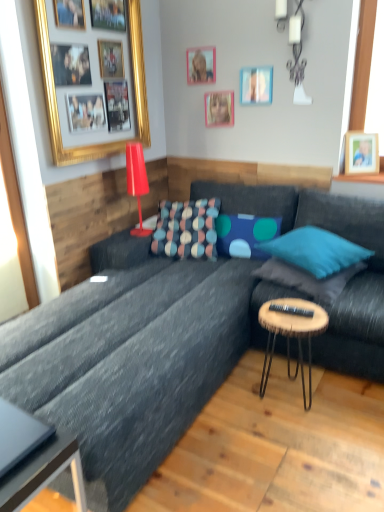
Locate an element on the screen. Image resolution: width=384 pixels, height=512 pixels. blue felt pillow at center, arranged as the 2th pillow when viewed from the left is located at coordinates (244, 234).

Find the location of a particular element. teal fabric pillow at center, which is counted as the third pillow, starting from the left is located at coordinates pyautogui.click(x=315, y=251).

You are a GUI agent. You are given a task and a screenshot of the screen. Output one action in this format:
    pyautogui.click(x=<x>, y=<y>)
    Task: Click on the white ceramic lamp at upper center, the 1th lamp in the right-to-left sequence
    Image resolution: width=384 pixels, height=512 pixels.
    Given the screenshot: What is the action you would take?
    pyautogui.click(x=297, y=55)

Which object is positioned more to the left, black plastic remote control at center or gold/gilded picture frame at upper left, the fifth picture frame viewed from the right?

From the viewer's perspective, gold/gilded picture frame at upper left, the fifth picture frame viewed from the right, appears more on the left side.

From a real-world perspective, which is physically above, black plastic remote control at center or gold/gilded picture frame at upper left, positioned as the 1th picture frame in left-to-right order?

From a 3D spatial view, gold/gilded picture frame at upper left, positioned as the 1th picture frame in left-to-right order, is above.

The height and width of the screenshot is (512, 384). I want to click on remote control to the right of gold/gilded picture frame at upper left, positioned as the 1th picture frame in left-to-right order, so click(x=291, y=310).

Which is correct: black plastic remote control at center is inside gold/gilded picture frame at upper left, the fifth picture frame viewed from the right, or outside of it?

black plastic remote control at center is outside gold/gilded picture frame at upper left, the fifth picture frame viewed from the right.

From a real-world perspective, is metallic gray coffee table at lower left positioned under wooden photo frame at upper center, the 4th picture frame when ordered from right to left, based on gravity?

Yes, from a real-world perspective, metallic gray coffee table at lower left is below wooden photo frame at upper center, the 4th picture frame when ordered from right to left.

What's the angular difference between metallic gray coffee table at lower left and wooden photo frame at upper center, the 4th picture frame when ordered from right to left,'s facing directions?

metallic gray coffee table at lower left and wooden photo frame at upper center, the 4th picture frame when ordered from right to left, are facing 89.9 degrees away from each other.

Is metallic gray coffee table at lower left wider or thinner than wooden photo frame at upper center, the 2th picture frame in the left-to-right sequence?

In the image, metallic gray coffee table at lower left appears to be wider than wooden photo frame at upper center, the 2th picture frame in the left-to-right sequence.

Identify the location of picture frame that is the 5th one when counting upward from the metallic gray coffee table at lower left (from the image's perspective). Image resolution: width=384 pixels, height=512 pixels. (201, 65).

From the image's perspective, is gold/gilded picture frame at upper left, the fifth picture frame viewed from the right, under textured gray couch at center?

No, from the image's perspective, gold/gilded picture frame at upper left, the fifth picture frame viewed from the right, is not below textured gray couch at center.

I want to click on picture frame that is the 3rd one when counting upward from the textured gray couch at center (from the image's perspective), so click(57, 105).

In terms of size, does gold/gilded picture frame at upper left, the fifth picture frame viewed from the right, appear bigger or smaller than textured gray couch at center?

Considering their sizes, gold/gilded picture frame at upper left, the fifth picture frame viewed from the right, takes up less space than textured gray couch at center.

Does gold/gilded picture frame at upper left, the fifth picture frame viewed from the right, have a greater height compared to textured gray couch at center?

Yes, gold/gilded picture frame at upper left, the fifth picture frame viewed from the right, is taller than textured gray couch at center.

Considering the sizes of wooden photo frame at upper center, the 2th picture frame in the left-to-right sequence, and wooden photo frame at upper right, acting as the 5th picture frame starting from the left, in the image, is wooden photo frame at upper center, the 2th picture frame in the left-to-right sequence, bigger or smaller than wooden photo frame at upper right, acting as the 5th picture frame starting from the left,?

wooden photo frame at upper center, the 2th picture frame in the left-to-right sequence, is smaller than wooden photo frame at upper right, acting as the 5th picture frame starting from the left.

In the scene shown: Is wooden photo frame at upper center, the 4th picture frame when ordered from right to left, looking in the opposite direction of wooden photo frame at upper right, acting as the 5th picture frame starting from the left?

wooden photo frame at upper center, the 4th picture frame when ordered from right to left, is not turned away from wooden photo frame at upper right, acting as the 5th picture frame starting from the left.

Can you confirm if wooden photo frame at upper center, the 2th picture frame in the left-to-right sequence, is positioned to the left of wooden photo frame at upper right, the 1th picture frame from the right?

Correct, you'll find wooden photo frame at upper center, the 2th picture frame in the left-to-right sequence, to the left of wooden photo frame at upper right, the 1th picture frame from the right.

Is wooden stool at center facing away from black plastic remote control at center?

That's not correct — wooden stool at center is not looking away from black plastic remote control at center.

From the image's perspective, which is above, wooden stool at center or black plastic remote control at center?

black plastic remote control at center, from the image's perspective.

Looking at the image, does wooden stool at center seem bigger or smaller compared to black plastic remote control at center?

wooden stool at center is bigger than black plastic remote control at center.

Based on the photo, is wooden stool at center positioned beyond the bounds of black plastic remote control at center?

wooden stool at center is positioned outside black plastic remote control at center.

Is teal fabric pillow at center, arranged as the 4th pillow when viewed from the left, shorter than wooden photo frame at upper center, the 2th picture frame in the left-to-right sequence?

Yes, teal fabric pillow at center, arranged as the 4th pillow when viewed from the left, is shorter than wooden photo frame at upper center, the 2th picture frame in the left-to-right sequence.

Is the surface of teal fabric pillow at center, arranged as the 4th pillow when viewed from the left, in direct contact with wooden photo frame at upper center, the 2th picture frame in the left-to-right sequence?

No, teal fabric pillow at center, arranged as the 4th pillow when viewed from the left, is not with wooden photo frame at upper center, the 2th picture frame in the left-to-right sequence.

Can we say teal fabric pillow at center, arranged as the first pillow when viewed from the right, lies outside wooden photo frame at upper center, the 4th picture frame when ordered from right to left?

Yes, teal fabric pillow at center, arranged as the first pillow when viewed from the right, is outside of wooden photo frame at upper center, the 4th picture frame when ordered from right to left.

In the scene shown: In terms of width, does teal fabric pillow at center, arranged as the first pillow when viewed from the right, look wider or thinner when compared to wooden photo frame at upper center, the 2th picture frame in the left-to-right sequence?

Considering their sizes, teal fabric pillow at center, arranged as the first pillow when viewed from the right, looks broader than wooden photo frame at upper center, the 2th picture frame in the left-to-right sequence.

Is white ceramic lamp at upper center, which appears as the 1th lamp when viewed from the top, surrounding matte pink picture frame at upper center, the 3th picture frame from the right?

That's incorrect, matte pink picture frame at upper center, the 3th picture frame from the right, is not inside white ceramic lamp at upper center, which appears as the 1th lamp when viewed from the top.

Considering the relative sizes of white ceramic lamp at upper center, which is the second lamp in bottom-to-top order, and matte pink picture frame at upper center, the 3th picture frame from the right, in the image provided, is white ceramic lamp at upper center, which is the second lamp in bottom-to-top order, shorter than matte pink picture frame at upper center, the 3th picture frame from the right,?

No, white ceramic lamp at upper center, which is the second lamp in bottom-to-top order, is not shorter than matte pink picture frame at upper center, the 3th picture frame from the right.

Could you measure the distance between white ceramic lamp at upper center, the second lamp positioned from the left, and matte pink picture frame at upper center, the 3th picture frame from the right?

white ceramic lamp at upper center, the second lamp positioned from the left, and matte pink picture frame at upper center, the 3th picture frame from the right, are 21.00 inches apart.

Which of these two, white ceramic lamp at upper center, which appears as the 1th lamp when viewed from the top, or matte pink picture frame at upper center, acting as the third picture frame starting from the left, is wider?

white ceramic lamp at upper center, which appears as the 1th lamp when viewed from the top, is wider.

Where is `the 4th picture frame directly above the black plastic remote control at center (from a real-world perspective)`? the 4th picture frame directly above the black plastic remote control at center (from a real-world perspective) is located at coordinates (57, 105).

This screenshot has height=512, width=384. What are the coordinates of `coffee table below the wooden photo frame at upper center, the 4th picture frame when ordered from right to left (from the image's perspective)` in the screenshot? It's located at (34, 458).

When comparing their distances from matte pink picture frame at upper center, the 3th picture frame from the right, does metallic gray coffee table at lower left or textured fabric pillow at center, the 4th pillow from the right, seem further?

metallic gray coffee table at lower left lies further to matte pink picture frame at upper center, the 3th picture frame from the right, than the other object.

From the image, which object appears to be nearer to wooden photo frame at upper right, the 1th picture frame from the right, matte pink picture frame at upper center, acting as the third picture frame starting from the left, or textured fabric pillow at center, positioned as the 1th pillow in left-to-right order?

Based on the image, matte pink picture frame at upper center, acting as the third picture frame starting from the left, appears to be nearer to wooden photo frame at upper right, the 1th picture frame from the right.

Considering their positions, is matte red lamp at upper left, which is the 1th lamp in bottom-to-top order, positioned further to textured gray couch at center than matte pink picture frame at upper center, the 3th picture frame from the right?

matte pink picture frame at upper center, the 3th picture frame from the right, is positioned further to the anchor textured gray couch at center.

Looking at the image, which one is located further to black plastic remote control at center, teal fabric pillow at center, arranged as the 4th pillow when viewed from the left, or white ceramic lamp at upper center, which is the second lamp in bottom-to-top order?

white ceramic lamp at upper center, which is the second lamp in bottom-to-top order, is positioned further to the anchor black plastic remote control at center.

Based on their spatial positions, is matte red lamp at upper left, arranged as the 2th lamp when viewed from the top, or wooden stool at center further from wooden picture frame at upper center, which is counted as the fourth picture frame, starting from the left?

Based on the image, wooden stool at center appears to be further to wooden picture frame at upper center, which is counted as the fourth picture frame, starting from the left.

From the image, which object appears to be nearer to wooden photo frame at upper center, the 2th picture frame in the left-to-right sequence, textured gray couch at center or blue felt pillow at center, arranged as the 2th pillow when viewed from the left?

The object closer to wooden photo frame at upper center, the 2th picture frame in the left-to-right sequence, is blue felt pillow at center, arranged as the 2th pillow when viewed from the left.

Looking at the image, which one is located further to wooden stool at center, textured gray couch at center or black plastic remote control at center?

textured gray couch at center lies further to wooden stool at center than the other object.

Which object lies further to the anchor point teal fabric pillow at center, arranged as the 2th pillow when viewed from the right, wooden stool at center or matte red lamp at upper left, which is the 1th lamp in bottom-to-top order?

Result: matte red lamp at upper left, which is the 1th lamp in bottom-to-top order, lies further to teal fabric pillow at center, arranged as the 2th pillow when viewed from the right, than the other object.

At what (x,y) coordinates should I click in order to perform the action: click on picture frame situated between matte pink picture frame at upper center, the 3th picture frame from the right, and wooden photo frame at upper right, acting as the 5th picture frame starting from the left, from left to right. Please return your answer as a coordinate pair (x, y). This screenshot has height=512, width=384. Looking at the image, I should click on (256, 85).

Where is `remote control between textured gray couch at center and wooden photo frame at upper center, the 2th picture frame in the left-to-right sequence, along the z-axis`? The image size is (384, 512). remote control between textured gray couch at center and wooden photo frame at upper center, the 2th picture frame in the left-to-right sequence, along the z-axis is located at coordinates (291, 310).

This screenshot has width=384, height=512. I want to click on remote control between metallic gray coffee table at lower left and wooden stool at center in the horizontal direction, so click(x=291, y=310).

Identify the location of table between metallic gray coffee table at lower left and textured fabric pillow at center, positioned as the 1th pillow in left-to-right order, from front to back. This screenshot has width=384, height=512. (291, 335).